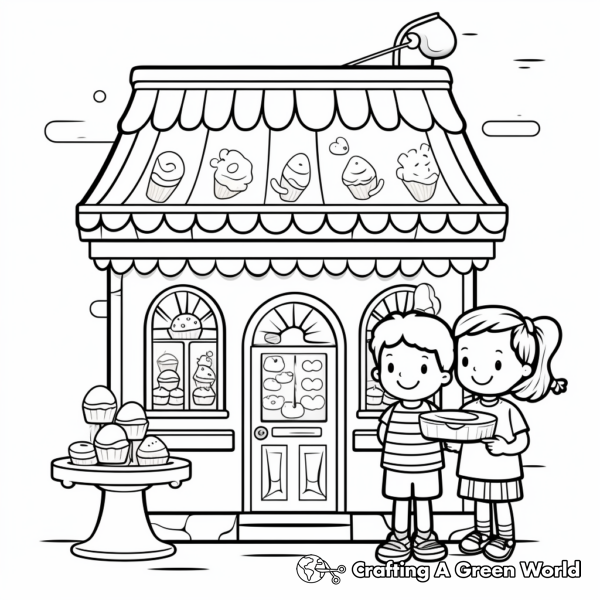
Locate an element on the screen. The height and width of the screenshot is (600, 600). window is located at coordinates (188, 358), (398, 310).